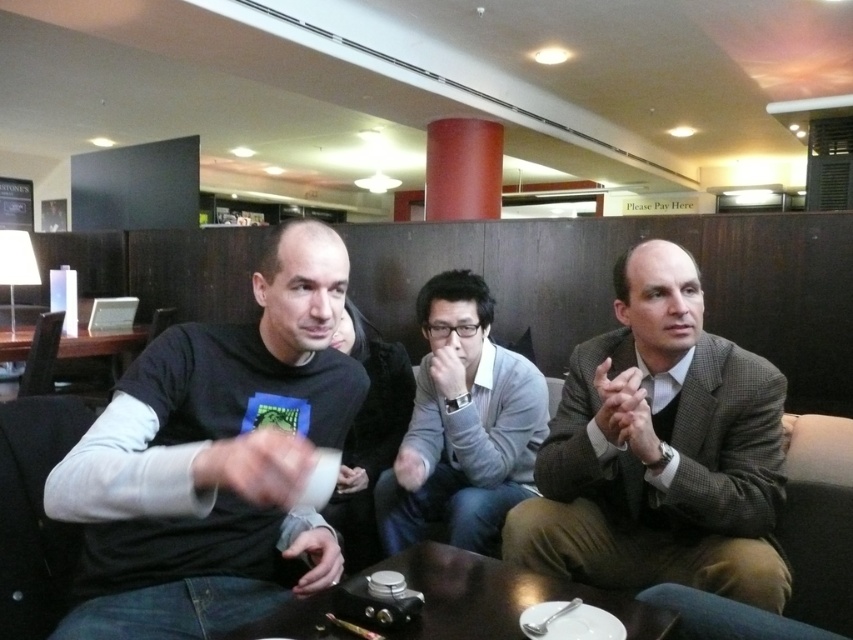
Is gray wool suit at center positioned in front of gray matte sweater at center?

Yes, gray wool suit at center is in front of gray matte sweater at center.

Is point (683, 262) positioned in front of point (450, 522)?

Yes, it is in front of point (450, 522).

The image size is (853, 640). Describe the element at coordinates (660, 451) in the screenshot. I see `gray wool suit at center` at that location.

Where is `gray wool suit at center`? The width and height of the screenshot is (853, 640). gray wool suit at center is located at coordinates (660, 451).

Which of these two, gray wool suit at center or shiny dark wood table at center, stands taller?

gray wool suit at center is taller.

Is point (660, 509) closer to viewer compared to point (485, 566)?

No.

Find the location of a particular element. The height and width of the screenshot is (640, 853). gray wool suit at center is located at coordinates (660, 451).

Does point (120, 474) come closer to viewer compared to point (430, 572)?

Yes, point (120, 474) is closer to viewer.

Is black matte shirt at center to the right of shiny dark wood table at center from the viewer's perspective?

No, black matte shirt at center is not to the right of shiny dark wood table at center.

Who is more distant from viewer, [111,522] or [465,618]?

The point [111,522] is more distant.

Where is `black matte shirt at center`? This screenshot has height=640, width=853. black matte shirt at center is located at coordinates (213, 460).